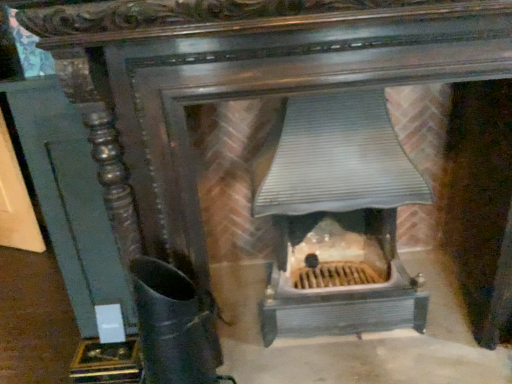
Question: From a real-world perspective, is black matte boot at lower left positioned above or below metallic gray heater at center?

Choices:
 (A) above
 (B) below

Answer: (B)

Question: Looking at their shapes, would you say black matte boot at lower left is wider or thinner than metallic gray heater at center?

Choices:
 (A) wide
 (B) thin

Answer: (B)

Question: Do you think black matte boot at lower left is within metallic gray heater at center, or outside of it?

Choices:
 (A) inside
 (B) outside

Answer: (B)

Question: From a real-world perspective, is metallic gray heater at center positioned above or below black matte boot at lower left?

Choices:
 (A) above
 (B) below

Answer: (A)

Question: Is metallic gray heater at center inside the boundaries of black matte boot at lower left, or outside?

Choices:
 (A) outside
 (B) inside

Answer: (A)

Question: Considering their positions, is metallic gray heater at center located in front of or behind black matte boot at lower left?

Choices:
 (A) front
 (B) behind

Answer: (B)

Question: Is metallic gray heater at center wider or thinner than black matte boot at lower left?

Choices:
 (A) thin
 (B) wide

Answer: (B)